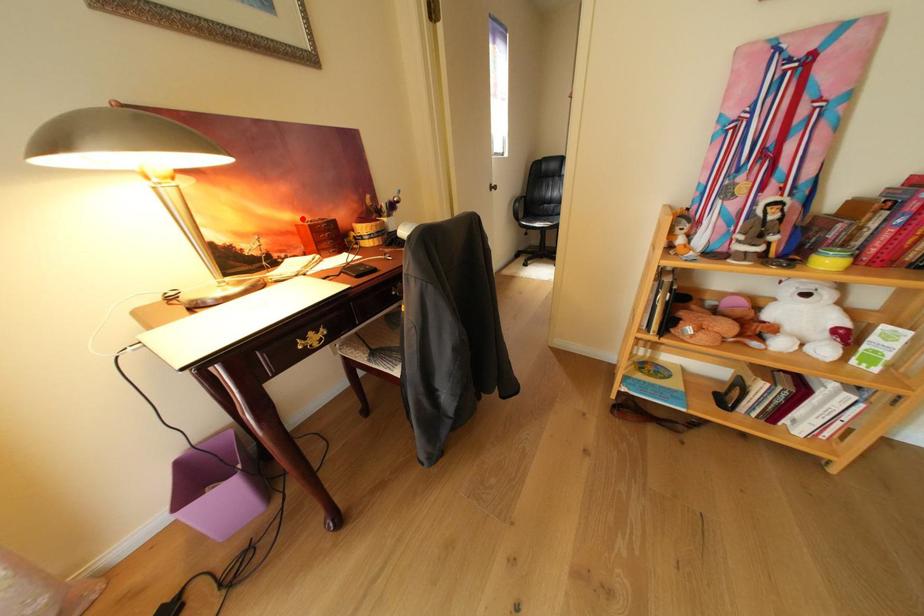
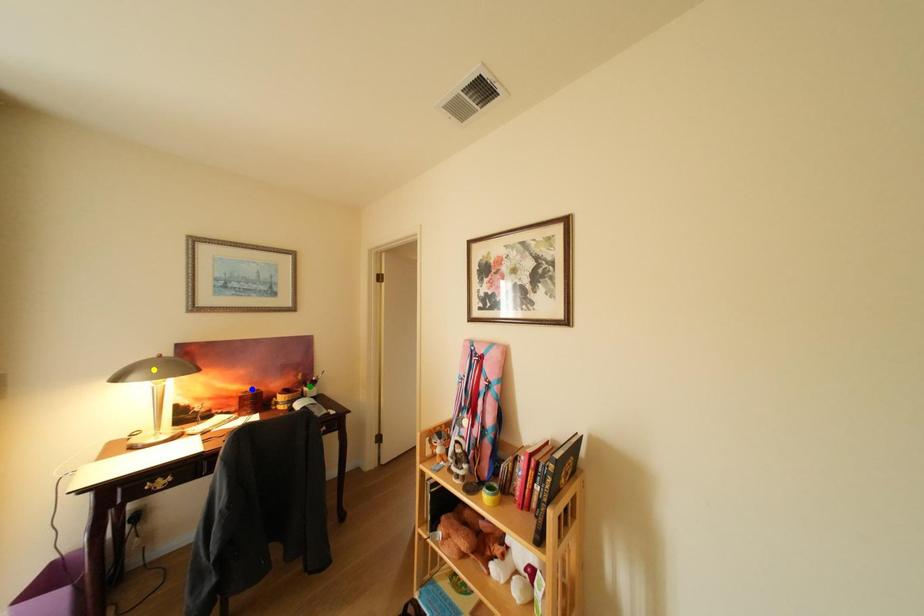
Question: I am providing you with two images of the same scene from different viewpoints. A red point is marked on the first image. You are given multiple points on the second image. Can you choose the point in image 2 that corresponds to the point in image 1?

Choices:
 (A) green point
 (B) yellow point
 (C) blue point

Answer: (C)